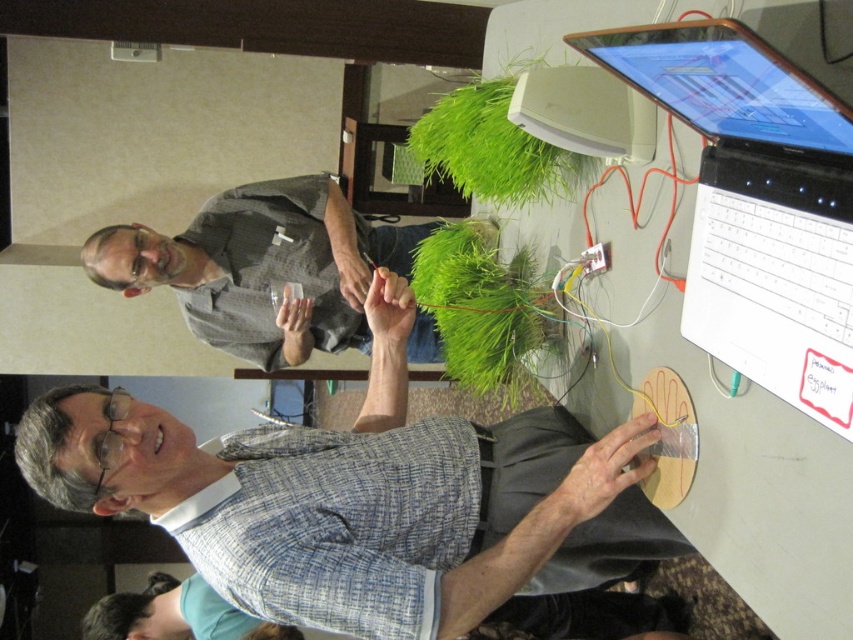
You are a visitor observing the demonstration. You notice the blue plaid shirt at lower center and the white plastic computer at upper center. Which object is located closer to the bottom of the image?

The blue plaid shirt at lower center is positioned under the white plastic computer at upper center, so it is closer to the bottom of the image.

You are a photographer trying to capture a closeup of the white plastic computer at upper center without including the blue plaid shirt at lower center in the frame. Given their relative sizes, is this possible?

The blue plaid shirt at lower center is wider than the white plastic computer at upper center. Since the shirt is wider, it might block the view of the computer unless positioned carefully. However, since the computer is at upper center and the shirt is lower, adjusting the camera angle upwards could exclude the shirt while focusing on the computer.

You are observing a demonstration where a man is explaining a plant connected to electronics. You need to determine the position of the gray fabric shirt at upper center relative to the white plastic computer at upper center. Which object is on the left side?

The gray fabric shirt at upper center is positioned on the left side of the white plastic computer at upper center.